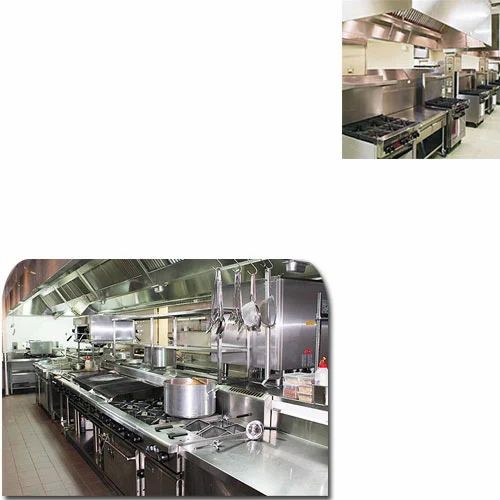
The height and width of the screenshot is (500, 500). I want to click on jug, so click(x=319, y=375).